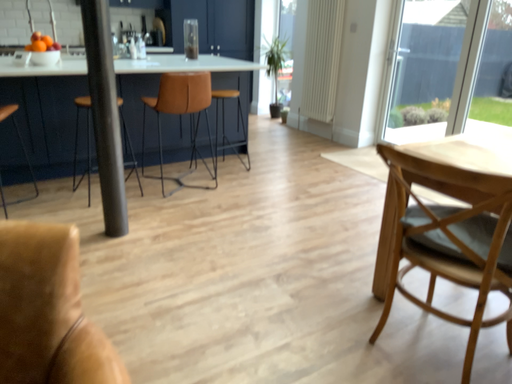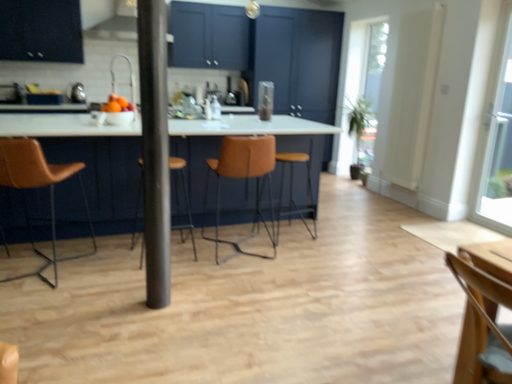
Question: How did the camera likely rotate when shooting the video?

Choices:
 (A) rotated downward
 (B) rotated upward

Answer: (B)